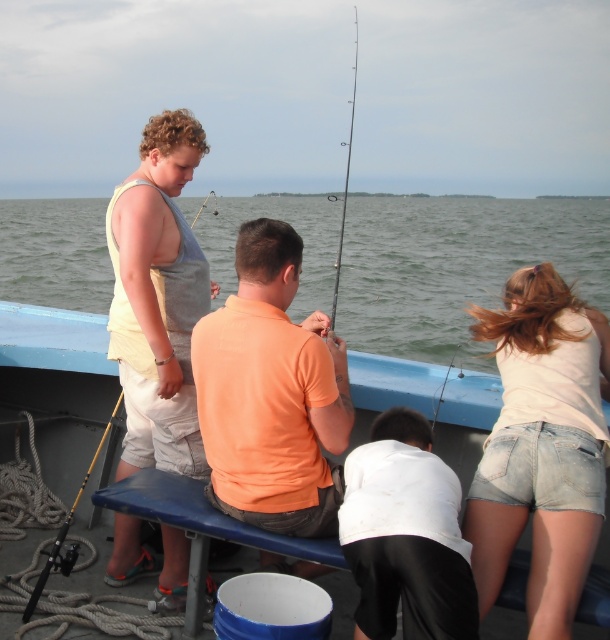
Can you confirm if white denim shorts at lower right is thinner than orange cotton shirt at center?

No, white denim shorts at lower right is not thinner than orange cotton shirt at center.

Which is in front, point (526, 486) or point (273, 285)?

Positioned in front is point (526, 486).

Which is behind, point (564, 417) or point (201, 392)?

Point (201, 392)

Locate an element on the screen. white denim shorts at lower right is located at coordinates (542, 445).

Is point (96, 237) positioned before point (148, 176)?

No, it is behind (148, 176).

Is clear blue water at center bigger than matte gray tank top at center?

Yes, clear blue water at center is bigger than matte gray tank top at center.

Which is in front, point (81, 272) or point (156, 364)?

Point (156, 364) is in front.

In order to click on clear blue water at center in this screenshot , I will do `click(456, 266)`.

Can you confirm if orange cotton shirt at center is shorter than yellow fiberglass fishing pole at lower left?

No.

Does orange cotton shirt at center appear over yellow fiberglass fishing pole at lower left?

Yes, orange cotton shirt at center is above yellow fiberglass fishing pole at lower left.

Is point (339, 416) closer to viewer compared to point (34, 595)?

Yes, it is.

The image size is (610, 640). I want to click on orange cotton shirt at center, so click(x=270, y=394).